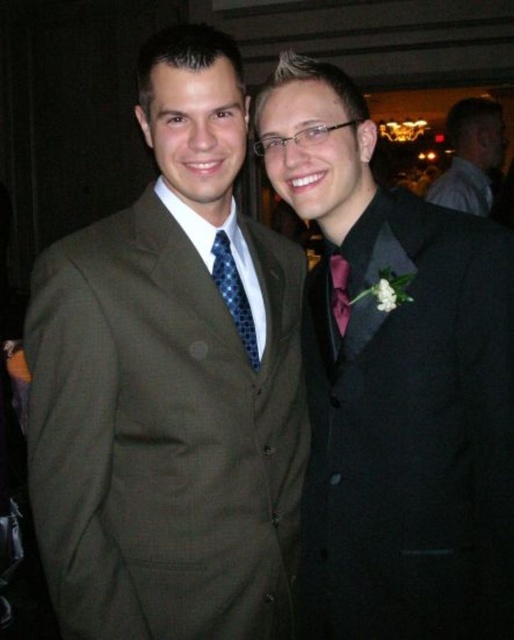
Can you confirm if blue dotted tie at center is thinner than matte blue tie at right?

In fact, blue dotted tie at center might be wider than matte blue tie at right.

The image size is (514, 640). Describe the element at coordinates (233, 294) in the screenshot. I see `blue dotted tie at center` at that location.

At what (x,y) coordinates should I click in order to perform the action: click on blue dotted tie at center. Please return your answer as a coordinate pair (x, y). Looking at the image, I should click on (233, 294).

Identify the location of blue dotted tie at center. This screenshot has width=514, height=640. click(x=233, y=294).

The height and width of the screenshot is (640, 514). What are the coordinates of `olive green wool suit at left` in the screenshot? It's located at (163, 433).

Is point (267, 266) in front of point (335, 317)?

No, it is not.

Locate an element on the screen. This screenshot has height=640, width=514. olive green wool suit at left is located at coordinates (163, 433).

Can you confirm if olive green wool suit at left is taller than black satin tuxedo at right?

Incorrect, olive green wool suit at left's height is not larger of black satin tuxedo at right's.

You are a GUI agent. You are given a task and a screenshot of the screen. Output one action in this format:
    pyautogui.click(x=<x>, y=<y>)
    Task: Click on the olive green wool suit at left
    This screenshot has height=640, width=514.
    Given the screenshot: What is the action you would take?
    pyautogui.click(x=163, y=433)